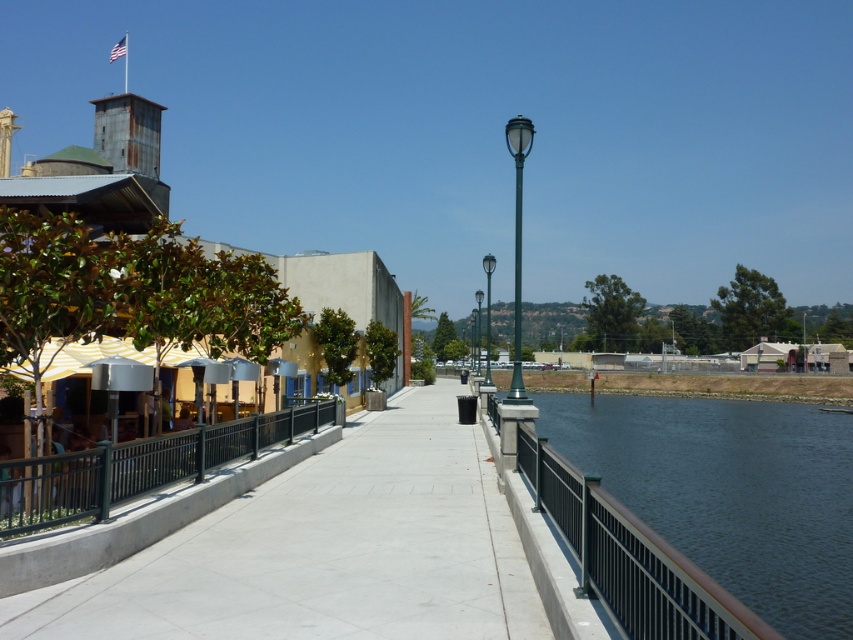
The width and height of the screenshot is (853, 640). Describe the element at coordinates (517, 246) in the screenshot. I see `green metallic streetlight at center-right` at that location.

Measure the distance between point [519,156] and camera.

Point [519,156] is 12.74 meters away from camera.

Identify the location of green metallic streetlight at center-right. (517, 246).

Does dark blue water at center have a greater height compared to black metal railing at lower left?

Correct, dark blue water at center is much taller as black metal railing at lower left.

Based on the photo, which of these two, dark blue water at center or black metal railing at lower left, stands shorter?

Standing shorter between the two is black metal railing at lower left.

Who is more forward, [740,445] or [3,525]?

Point [3,525] is more forward.

The width and height of the screenshot is (853, 640). I want to click on dark blue water at center, so click(729, 493).

Describe the element at coordinates (137, 467) in the screenshot. This screenshot has width=853, height=640. I see `black metal railing at lower left` at that location.

Can you confirm if black metal railing at lower left is positioned below green metallic streetlight at center?

Yes.

Is point (79, 509) more distant than point (479, 300)?

No, it is not.

Find the location of `black metal railing at lower left`. black metal railing at lower left is located at coordinates (137, 467).